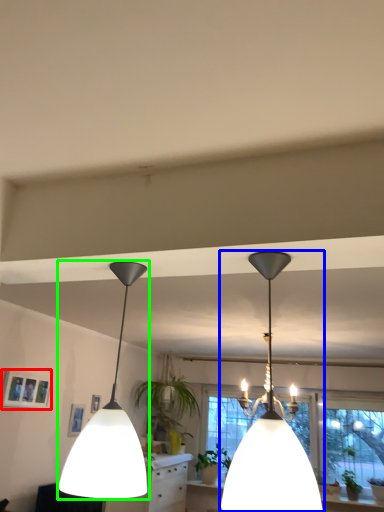
Question: Based on their relative distances, which object is farther from picture frame (highlighted by a red box)? Choose from lamp (highlighted by a blue box) and lamp (highlighted by a green box).

Choices:
 (A) lamp
 (B) lamp

Answer: (A)